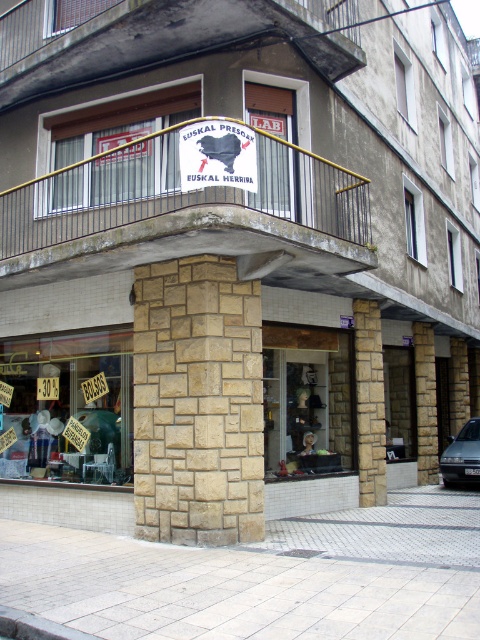
Which is more to the right, white brick pavement at lower center or brown stone pillar at center?

Positioned to the right is brown stone pillar at center.

Which of these two, white brick pavement at lower center or brown stone pillar at center, stands taller?

With more height is brown stone pillar at center.

Does point (172, 596) lie in front of point (379, 312)?

Yes, point (172, 596) is in front of point (379, 312).

In order to click on white brick pavement at lower center in this screenshot , I will do `click(261, 576)`.

Can you confirm if natural stone column at center is smaller than brown stone pillar at center?

No.

Based on the photo, which is more to the right, natural stone column at center or brown stone pillar at center?

brown stone pillar at center

Does point (255, 296) come in front of point (367, 403)?

Yes, it is.

Where is `natural stone column at center`? The width and height of the screenshot is (480, 640). natural stone column at center is located at coordinates (197, 403).

Is point (192, 268) positioned after point (427, 412)?

No, it is in front of (427, 412).

Does natural stone column at center appear under stone at center?

No.

Does point (156, 308) come in front of point (427, 365)?

Yes, it is.

This screenshot has width=480, height=640. In order to click on natural stone column at center in this screenshot , I will do `click(197, 403)`.